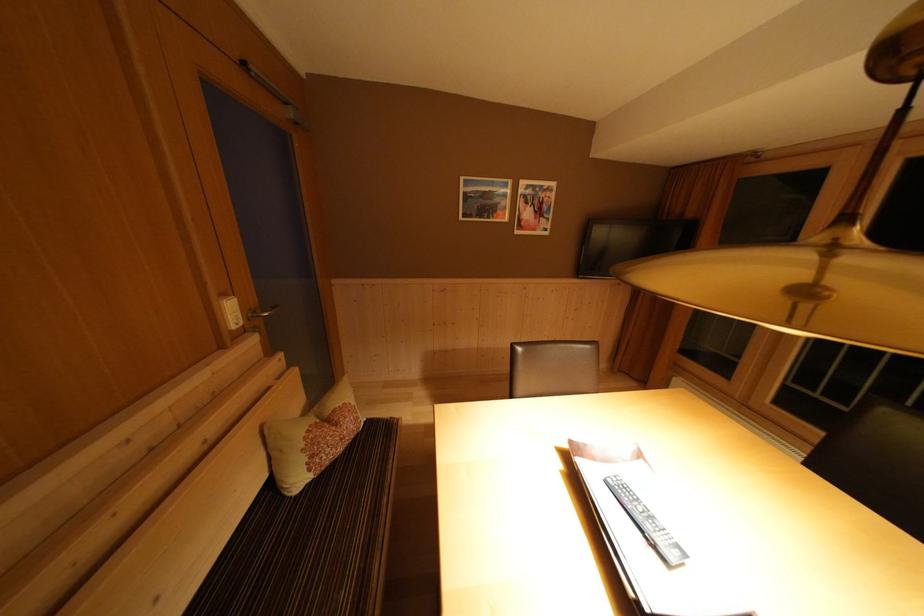
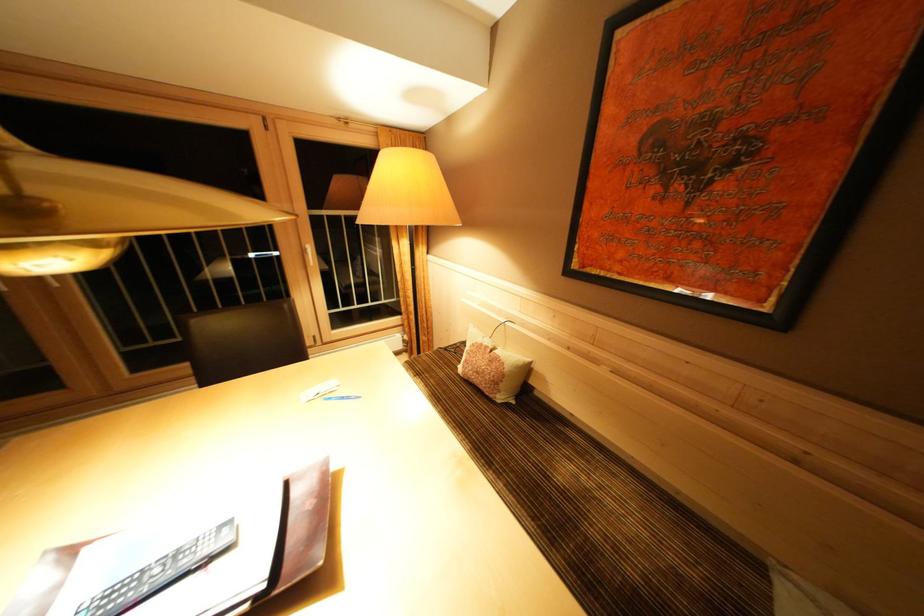
Find the pixel in the second image that matches [641,505] in the first image.

(147, 584)